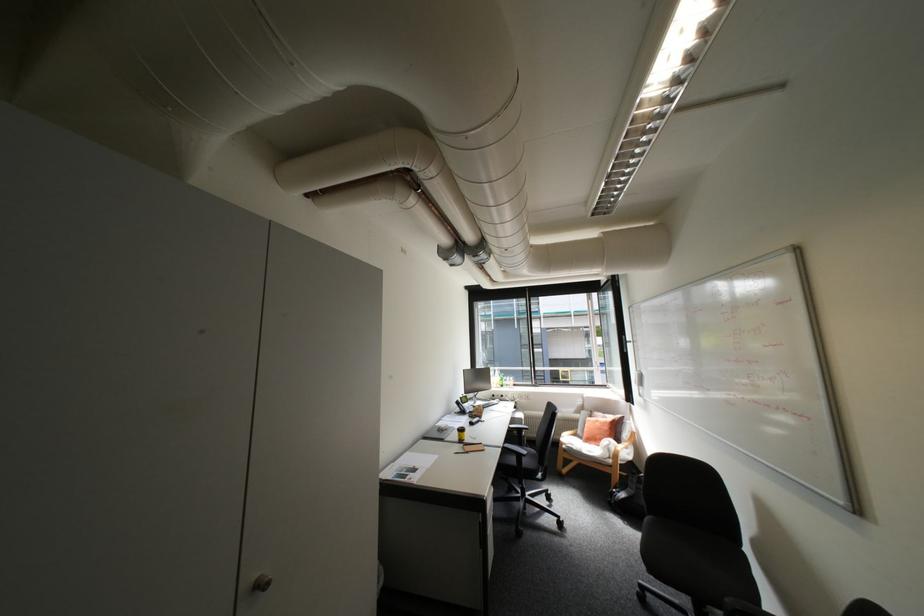
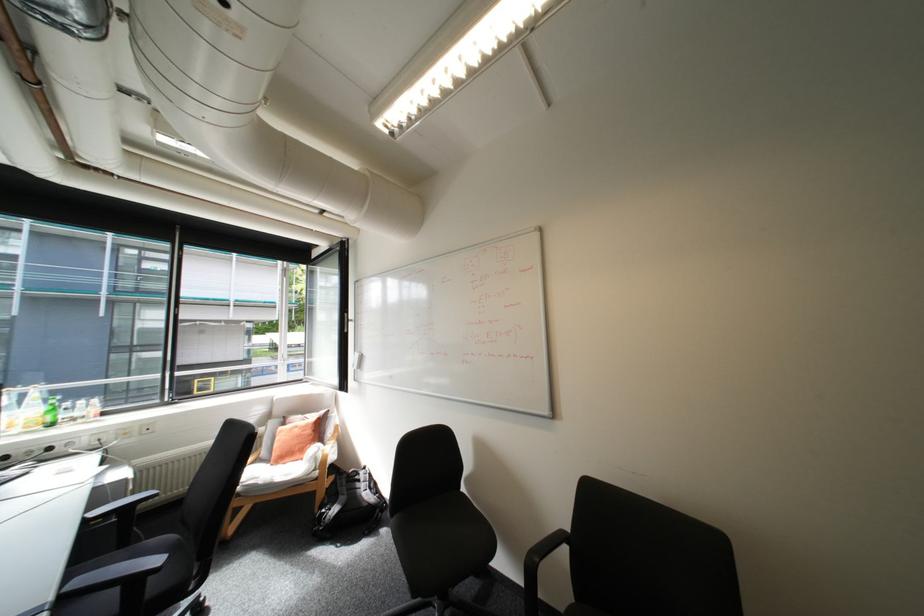
Where in the second image is the point corresponding to pixel 628 493 from the first image?

(339, 509)